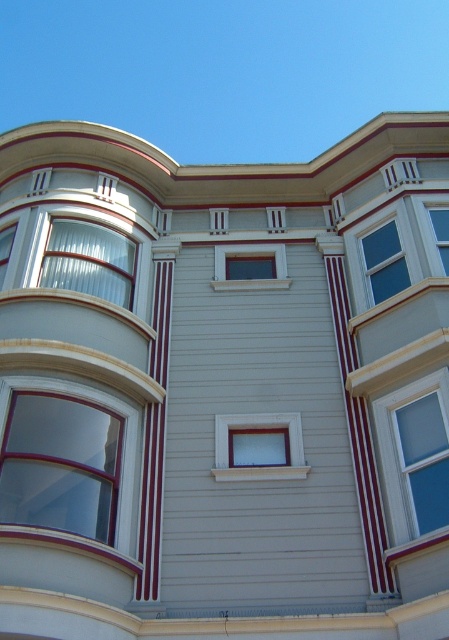
You are standing in front of the building and want to determine the relative positions of two points marked on its facade. The first point is at coordinates point [361,237] and the second is at point [1,268]. Which point appears closer to you?

Point [361,237] is further to the viewer than point [1,268], so the point at [361,237] appears closer to you.

You are an architect examining the building facade. You need to install a new light fixture between the matte glass window at left and the matte white window at center. Based on their positions, where should the light fixture be placed?

The matte glass window at left is located above the matte white window at center, so the light fixture should be placed between them in the vertical space separating the two windows.

You are an architect examining the building facade. You need to determine the relative positions of the matte glass window at left and the clear glass window at upper right. Which window is located to the left of the other?

The matte glass window at left is positioned on the left side of clear glass window at upper right.